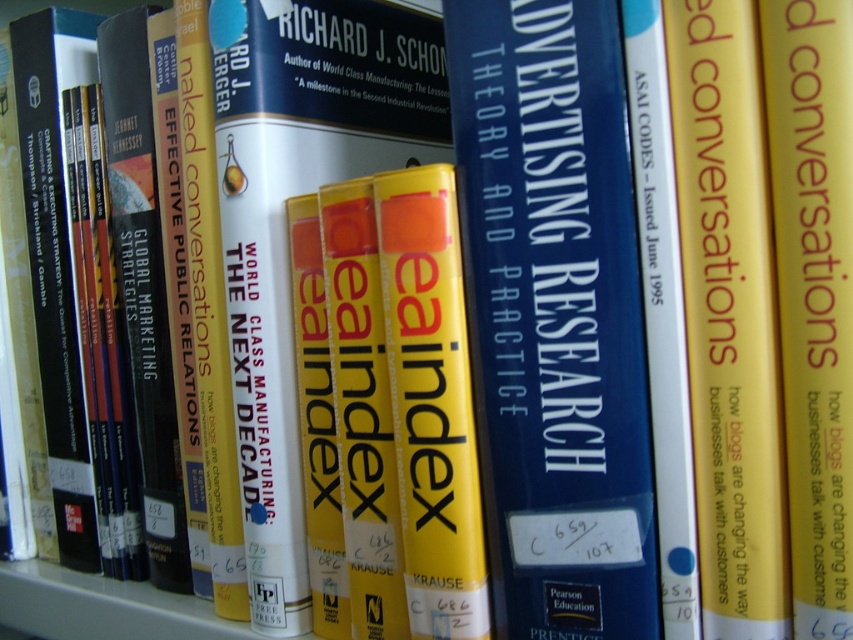
Which of these two, blue hardcover book at center or hardcover book at center, stands taller?

Standing taller between the two is hardcover book at center.

This screenshot has height=640, width=853. What do you see at coordinates (554, 316) in the screenshot?
I see `blue hardcover book at center` at bounding box center [554, 316].

Locate an element on the screen. The image size is (853, 640). blue hardcover book at center is located at coordinates (554, 316).